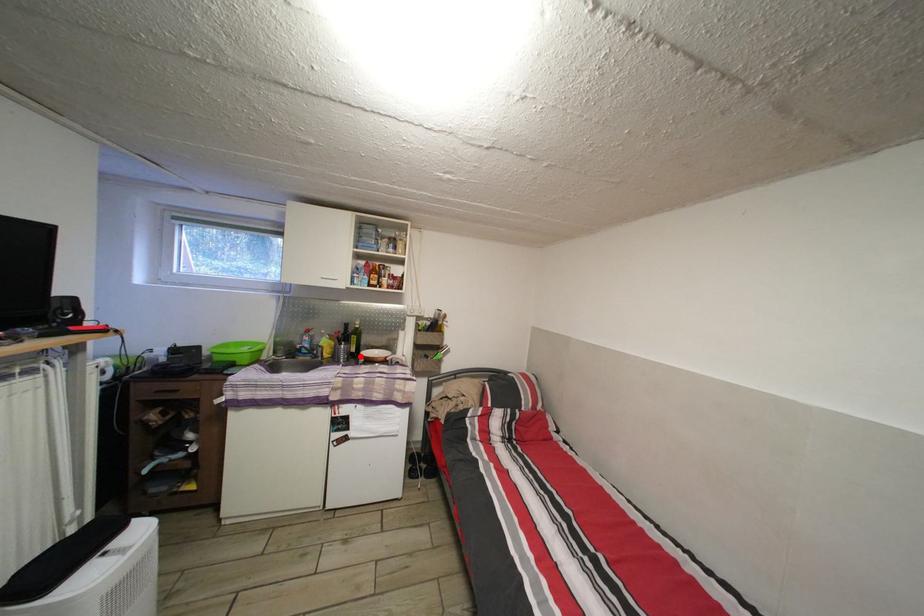
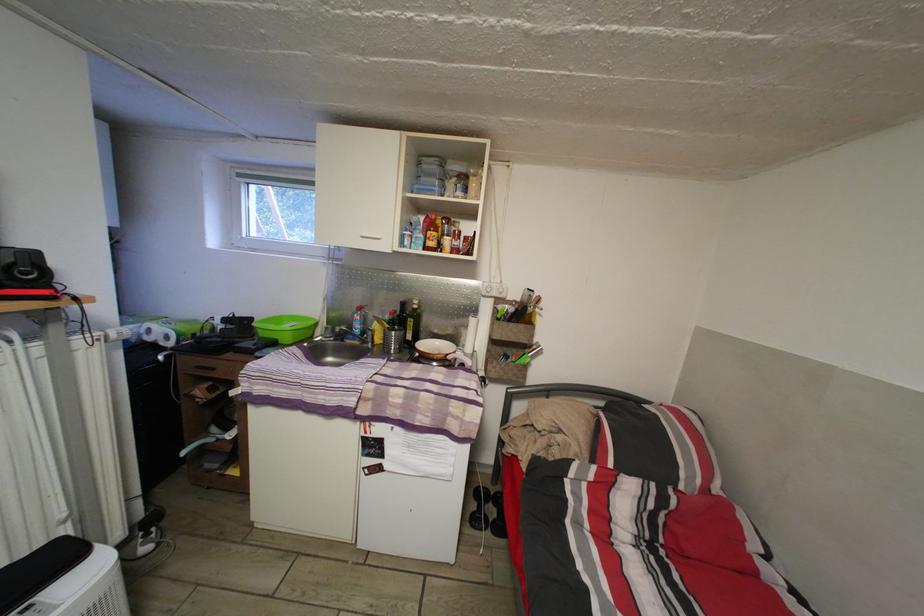
Question: I am providing you with two images of the same scene from different viewpoints. A red point is marked on the first image. At the location where the point appears in image 1, is it still visible in image 2?

Choices:
 (A) Yes
 (B) No

Answer: (A)